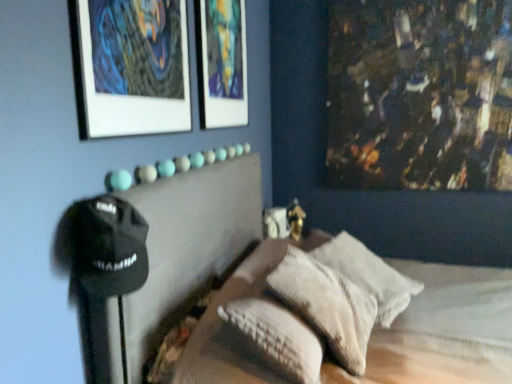
Where is `textured beige pillow at center, the 1th pillow in the front-to-back sequence`? textured beige pillow at center, the 1th pillow in the front-to-back sequence is located at coordinates (327, 305).

What is the approximate height of matte glass picture frame at upper center, the 2th picture frame from the front?

matte glass picture frame at upper center, the 2th picture frame from the front, is 29.50 inches in height.

You are a GUI agent. You are given a task and a screenshot of the screen. Output one action in this format:
    pyautogui.click(x=<x>, y=<y>)
    Task: Click on the white textured pillow at center, the second pillow in the front-to-back sequence
    This screenshot has height=384, width=512.
    Given the screenshot: What is the action you would take?
    pyautogui.click(x=369, y=275)

Is point (366, 325) positioned behind point (121, 30)?

Yes, it is.

Are textured beige pillow at center, the 1th pillow in the front-to-back sequence, and matte white picture frame at upper left, the 2th picture frame viewed from the back, beside each other?

No, textured beige pillow at center, the 1th pillow in the front-to-back sequence, is not beside matte white picture frame at upper left, the 2th picture frame viewed from the back.

From a real-world perspective, is textured beige pillow at center, the 1th pillow in the front-to-back sequence, physically located above or below matte white picture frame at upper left, arranged as the 1th picture frame when viewed from the left?

Clearly, from a real-world perspective, textured beige pillow at center, the 1th pillow in the front-to-back sequence, is below matte white picture frame at upper left, arranged as the 1th picture frame when viewed from the left.

From the image's perspective, is textured beige pillow at center, the 1th pillow in the front-to-back sequence, located above white textured pillow at center, the second pillow in the front-to-back sequence?

No, from the image's perspective, textured beige pillow at center, the 1th pillow in the front-to-back sequence, is not on top of white textured pillow at center, the second pillow in the front-to-back sequence.

The height and width of the screenshot is (384, 512). I want to click on pillow that appears above the white textured pillow at center, which appears as the 1th pillow when viewed from the back (from a real-world perspective), so click(x=327, y=305).

Does textured beige pillow at center, the 1th pillow in the front-to-back sequence, have a lesser height compared to white textured pillow at center, which appears as the 1th pillow when viewed from the back?

In fact, textured beige pillow at center, the 1th pillow in the front-to-back sequence, may be taller than white textured pillow at center, which appears as the 1th pillow when viewed from the back.

Between textured beige pillow at center, the 1th pillow in the front-to-back sequence, and white textured pillow at center, the second pillow in the front-to-back sequence, which one has smaller width?

textured beige pillow at center, the 1th pillow in the front-to-back sequence, is thinner.

In the scene shown: Is white textured pillow at center, which appears as the 1th pillow when viewed from the back, looking in the opposite direction of textured beige pillow at center, the 1th pillow in the front-to-back sequence?

No, white textured pillow at center, which appears as the 1th pillow when viewed from the back, is not facing the opposite direction of textured beige pillow at center, the 1th pillow in the front-to-back sequence.

Considering the positions of points (385, 317) and (301, 299), is point (385, 317) closer to camera compared to point (301, 299)?

No, it is behind (301, 299).

Which object is further away from the camera, white textured pillow at center, the second pillow in the front-to-back sequence, or textured beige pillow at center, the 1th pillow in the front-to-back sequence?

Positioned behind is white textured pillow at center, the second pillow in the front-to-back sequence.

Is white textured pillow at center, which appears as the 1th pillow when viewed from the back, to the left or to the right of matte white picture frame at upper left, the 2th picture frame viewed from the back, in the image?

From the image, it's evident that white textured pillow at center, which appears as the 1th pillow when viewed from the back, is to the right of matte white picture frame at upper left, the 2th picture frame viewed from the back.

Does white textured pillow at center, the second pillow in the front-to-back sequence, have a lesser height compared to matte white picture frame at upper left, arranged as the 1th picture frame when viewed from the left?

Correct, white textured pillow at center, the second pillow in the front-to-back sequence, is not as tall as matte white picture frame at upper left, arranged as the 1th picture frame when viewed from the left.

From the image's perspective, which is above, white textured pillow at center, which appears as the 1th pillow when viewed from the back, or matte white picture frame at upper left, arranged as the 1th picture frame when viewed from the left?

matte white picture frame at upper left, arranged as the 1th picture frame when viewed from the left, is shown above in the image.

From a real-world perspective, does white textured pillow at center, which appears as the 1th pillow when viewed from the back, sit lower than matte white picture frame at upper left, the 2th picture frame viewed from the back?

Yes.

Considering the relative sizes of white textured pillow at center, which appears as the 1th pillow when viewed from the back, and matte glass picture frame at upper center, the first picture frame positioned from the back, in the image provided, is white textured pillow at center, which appears as the 1th pillow when viewed from the back, shorter than matte glass picture frame at upper center, the first picture frame positioned from the back,?

Correct, white textured pillow at center, which appears as the 1th pillow when viewed from the back, is not as tall as matte glass picture frame at upper center, the first picture frame positioned from the back.

Does white textured pillow at center, the second pillow in the front-to-back sequence, appear on the right side of matte glass picture frame at upper center, the 2th picture frame when ordered from left to right?

Correct, you'll find white textured pillow at center, the second pillow in the front-to-back sequence, to the right of matte glass picture frame at upper center, the 2th picture frame when ordered from left to right.

Is white textured pillow at center, the second pillow in the front-to-back sequence, inside or outside of matte glass picture frame at upper center, the first picture frame positioned from the back?

white textured pillow at center, the second pillow in the front-to-back sequence, is outside matte glass picture frame at upper center, the first picture frame positioned from the back.

From the picture: From a real-world perspective, is white textured pillow at center, the second pillow in the front-to-back sequence, physically located above or below matte glass picture frame at upper center, the 2th picture frame when ordered from left to right?

white textured pillow at center, the second pillow in the front-to-back sequence, is situated lower than matte glass picture frame at upper center, the 2th picture frame when ordered from left to right, in the real world.

Between textured beige pillow at center, the second pillow positioned from the back, and matte glass picture frame at upper center, the 2th picture frame when ordered from left to right, which one has less height?

textured beige pillow at center, the second pillow positioned from the back, is shorter.

Would you say matte glass picture frame at upper center, the 2th picture frame when ordered from left to right, is part of textured beige pillow at center, the second pillow positioned from the back,'s contents?

That's incorrect, matte glass picture frame at upper center, the 2th picture frame when ordered from left to right, is not inside textured beige pillow at center, the second pillow positioned from the back.

From the image's perspective, is textured beige pillow at center, the 1th pillow in the front-to-back sequence, below matte glass picture frame at upper center, the 2th picture frame when ordered from left to right?

Yes.

Identify the location of pillow that is the 2nd one when counting downward from the matte glass picture frame at upper center, the 2th picture frame from the front (from the image's perspective). pyautogui.click(x=327, y=305).

Is matte glass picture frame at upper center, the 2th picture frame when ordered from left to right, in front of or behind matte white picture frame at upper left, the 2th picture frame viewed from the back, in the image?

Visually, matte glass picture frame at upper center, the 2th picture frame when ordered from left to right, is located behind matte white picture frame at upper left, the 2th picture frame viewed from the back.

Locate an element on the screen. The image size is (512, 384). picture frame above the matte white picture frame at upper left, arranged as the 1th picture frame when viewed from the left (from the image's perspective) is located at coordinates (222, 63).

Which object is wider, matte glass picture frame at upper center, the 2th picture frame from the front, or matte white picture frame at upper left, which is the 2th picture frame from right to left?

With larger width is matte glass picture frame at upper center, the 2th picture frame from the front.

Locate an element on the screen. This screenshot has height=384, width=512. the 1st pillow to the right of the matte white picture frame at upper left, placed as the 1th picture frame when sorted from front to back, counting from the anchor's position is located at coordinates (x=327, y=305).

Locate an element on the screen. This screenshot has width=512, height=384. pillow beneath the textured beige pillow at center, the 1th pillow in the front-to-back sequence (from a real-world perspective) is located at coordinates (369, 275).

From the image, which object appears to be nearer to matte white picture frame at upper left, the 2th picture frame viewed from the back, matte glass picture frame at upper center, acting as the first picture frame starting from the right, or textured beige pillow at center, the 1th pillow in the front-to-back sequence?

Among the two, matte glass picture frame at upper center, acting as the first picture frame starting from the right, is located nearer to matte white picture frame at upper left, the 2th picture frame viewed from the back.

From the image, which object appears to be nearer to matte glass picture frame at upper center, acting as the first picture frame starting from the right, matte white picture frame at upper left, placed as the 1th picture frame when sorted from front to back, or textured beige pillow at center, the second pillow positioned from the back?

Based on the image, matte white picture frame at upper left, placed as the 1th picture frame when sorted from front to back, appears to be nearer to matte glass picture frame at upper center, acting as the first picture frame starting from the right.

Looking at this image, considering their positions, is matte glass picture frame at upper center, the first picture frame positioned from the back, positioned further to textured beige pillow at center, the second pillow positioned from the back, than matte white picture frame at upper left, placed as the 1th picture frame when sorted from front to back?

matte glass picture frame at upper center, the first picture frame positioned from the back, is further to textured beige pillow at center, the second pillow positioned from the back.

Based on the photo, which object lies further to the anchor point matte white picture frame at upper left, which is the 2th picture frame from right to left, matte glass picture frame at upper center, the first picture frame positioned from the back, or white textured pillow at center, the second pillow in the front-to-back sequence?

Based on the image, white textured pillow at center, the second pillow in the front-to-back sequence, appears to be further to matte white picture frame at upper left, which is the 2th picture frame from right to left.

When comparing their distances from white textured pillow at center, which appears as the 1th pillow when viewed from the back, does textured beige pillow at center, the 1th pillow in the front-to-back sequence, or matte glass picture frame at upper center, acting as the first picture frame starting from the right, seem further?

matte glass picture frame at upper center, acting as the first picture frame starting from the right, lies further to white textured pillow at center, which appears as the 1th pillow when viewed from the back, than the other object.

Based on their spatial positions, is matte white picture frame at upper left, arranged as the 1th picture frame when viewed from the left, or white textured pillow at center, the second pillow in the front-to-back sequence, closer to textured beige pillow at center, the second pillow positioned from the back?

white textured pillow at center, the second pillow in the front-to-back sequence, lies closer to textured beige pillow at center, the second pillow positioned from the back, than the other object.

When comparing their distances from white textured pillow at center, which appears as the 1th pillow when viewed from the back, does textured beige pillow at center, the 1th pillow in the front-to-back sequence, or matte white picture frame at upper left, arranged as the 1th picture frame when viewed from the left, seem closer?

Among the two, textured beige pillow at center, the 1th pillow in the front-to-back sequence, is located nearer to white textured pillow at center, which appears as the 1th pillow when viewed from the back.

Looking at the image, which one is located further to matte glass picture frame at upper center, the 2th picture frame when ordered from left to right, white textured pillow at center, the second pillow in the front-to-back sequence, or matte white picture frame at upper left, arranged as the 1th picture frame when viewed from the left?

The object further to matte glass picture frame at upper center, the 2th picture frame when ordered from left to right, is white textured pillow at center, the second pillow in the front-to-back sequence.

The width and height of the screenshot is (512, 384). What are the coordinates of `pillow that lies between matte glass picture frame at upper center, the first picture frame positioned from the back, and textured beige pillow at center, the second pillow positioned from the back, from top to bottom` in the screenshot? It's located at (369, 275).

This screenshot has width=512, height=384. What are the coordinates of `picture frame between matte glass picture frame at upper center, acting as the first picture frame starting from the right, and white textured pillow at center, the second pillow in the front-to-back sequence, in the vertical direction` in the screenshot? It's located at (131, 66).

This screenshot has height=384, width=512. Find the location of `pillow between matte white picture frame at upper left, the 2th picture frame viewed from the back, and textured beige pillow at center, the 1th pillow in the front-to-back sequence, in the vertical direction`. pillow between matte white picture frame at upper left, the 2th picture frame viewed from the back, and textured beige pillow at center, the 1th pillow in the front-to-back sequence, in the vertical direction is located at coordinates (369, 275).

I want to click on picture frame that lies between matte glass picture frame at upper center, the 2th picture frame from the front, and textured beige pillow at center, the 1th pillow in the front-to-back sequence, from top to bottom, so click(131, 66).